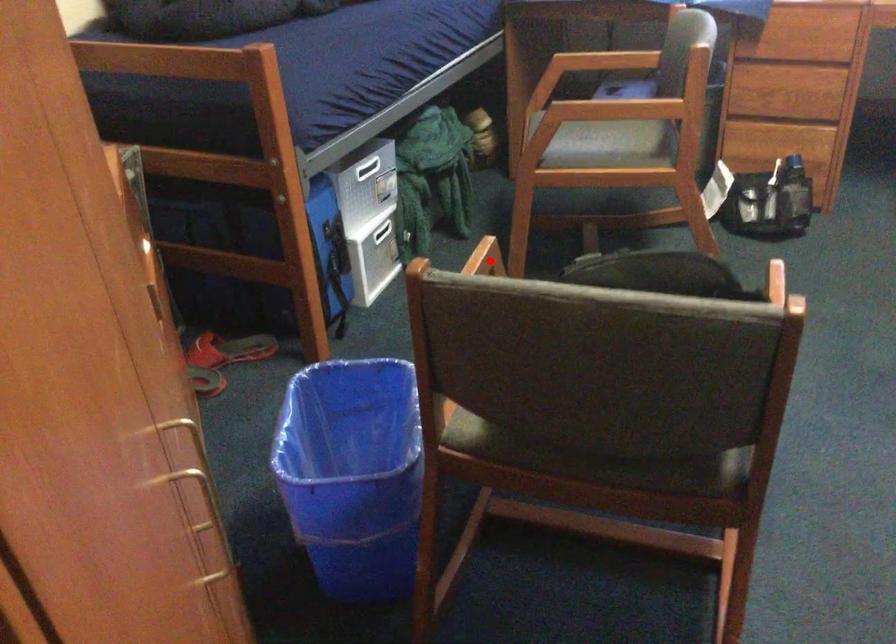
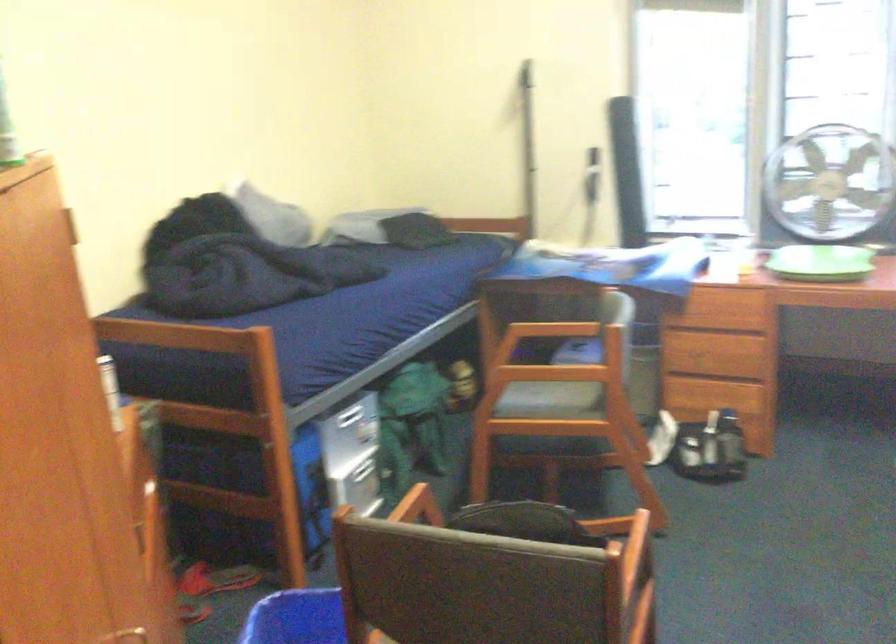
Locate, in the second image, the point that corresponds to the highlighted location in the first image.

(418, 506)